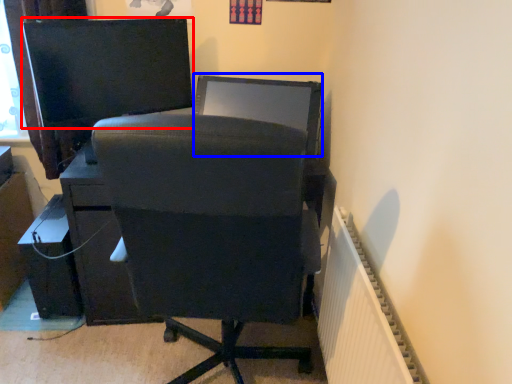
Question: Which object is closer to the camera taking this photo, computer monitor (highlighted by a red box) or computer monitor (highlighted by a blue box)?

Choices:
 (A) computer monitor
 (B) computer monitor

Answer: (A)